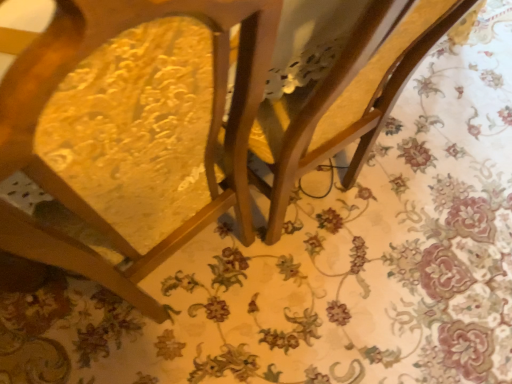
Question: Considering the positions of wooden swivel chair at center and wooden chair at center in the image, is wooden swivel chair at center bigger or smaller than wooden chair at center?

Choices:
 (A) small
 (B) big

Answer: (A)

Question: Considering the positions of point (386, 107) and point (162, 254), is point (386, 107) closer or farther from the camera than point (162, 254)?

Choices:
 (A) closer
 (B) farther

Answer: (B)

Question: Looking at their shapes, would you say wooden swivel chair at center is wider or thinner than wooden chair at center?

Choices:
 (A) wide
 (B) thin

Answer: (B)

Question: From the image's perspective, is wooden chair at center positioned above or below wooden swivel chair at center?

Choices:
 (A) below
 (B) above

Answer: (A)

Question: Relative to wooden swivel chair at center, is wooden chair at center in front or behind?

Choices:
 (A) front
 (B) behind

Answer: (A)

Question: From a real-world perspective, is wooden chair at center above or below wooden swivel chair at center?

Choices:
 (A) below
 (B) above

Answer: (B)

Question: Considering the positions of wooden chair at center and wooden swivel chair at center in the image, is wooden chair at center taller or shorter than wooden swivel chair at center?

Choices:
 (A) tall
 (B) short

Answer: (A)